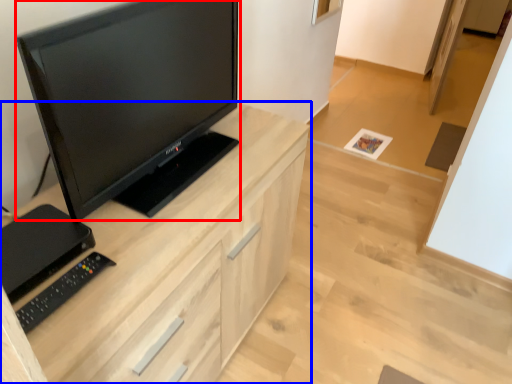
Question: Which point is closer to the camera, television (highlighted by a red box) or cabinetry (highlighted by a blue box)?

Choices:
 (A) television
 (B) cabinetry

Answer: (A)